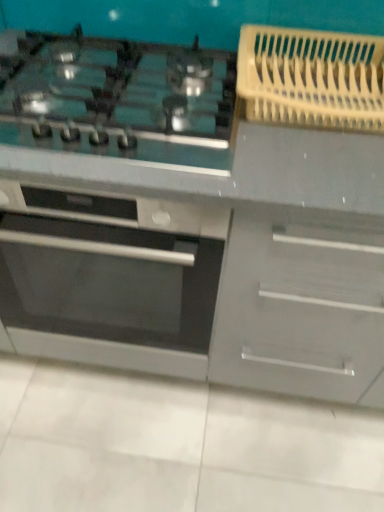
Image resolution: width=384 pixels, height=512 pixels. I want to click on satin black cooktop at upper left, so click(118, 100).

What is the approximate height of satin black cooktop at upper left?

3.43 inches.

What do you see at coordinates (118, 100) in the screenshot? I see `satin black cooktop at upper left` at bounding box center [118, 100].

Describe the element at coordinates (108, 280) in the screenshot. I see `satin silver oven at center` at that location.

Identify the location of satin silver oven at center. This screenshot has height=512, width=384. (108, 280).

Locate an element on the screen. The height and width of the screenshot is (512, 384). satin black cooktop at upper left is located at coordinates (118, 100).

Is satin silver oven at center at the right side of satin black cooktop at upper left?

No, satin silver oven at center is not to the right of satin black cooktop at upper left.

Considering their positions, is satin silver oven at center located in front of or behind satin black cooktop at upper left?

Clearly, satin silver oven at center is behind satin black cooktop at upper left.

Which point is more forward, [72,268] or [135,59]?

The point [135,59] is closer.

Based on the photo, from the image's perspective, between satin silver oven at center and satin black cooktop at upper left, who is located below?

satin silver oven at center, from the image's perspective.

From a real-world perspective, is satin silver oven at center below satin black cooktop at upper left?

Indeed, from a real-world perspective, satin silver oven at center is positioned beneath satin black cooktop at upper left.

Between satin silver oven at center and satin black cooktop at upper left, which one has smaller width?

With smaller width is satin black cooktop at upper left.

Who is shorter, satin silver oven at center or satin black cooktop at upper left?

Standing shorter between the two is satin black cooktop at upper left.

Which of these two, satin silver oven at center or satin black cooktop at upper left, is smaller?

Smaller between the two is satin black cooktop at upper left.

Can we say satin silver oven at center lies outside satin black cooktop at upper left?

Absolutely, satin silver oven at center is external to satin black cooktop at upper left.

From the picture: Is satin silver oven at center not near satin black cooktop at upper left?

Actually, satin silver oven at center and satin black cooktop at upper left are a little close together.

Is satin silver oven at center looking in the opposite direction of satin black cooktop at upper left?

No, satin silver oven at center is not facing away from satin black cooktop at upper left.

The width and height of the screenshot is (384, 512). In order to click on gas stove in front of the satin silver oven at center in this screenshot , I will do `click(118, 100)`.

Considering the relative positions of satin black cooktop at upper left and satin silver oven at center in the image provided, is satin black cooktop at upper left to the left or to the right of satin silver oven at center?

In the image, satin black cooktop at upper left appears on the right side of satin silver oven at center.

Between satin black cooktop at upper left and satin silver oven at center, which one is positioned in front?

satin black cooktop at upper left.

Between point (167, 64) and point (165, 228), which one is positioned in front?

The point (165, 228) is in front.

From the image's perspective, is satin black cooktop at upper left located above or below satin silver oven at center?

Clearly, from the image's perspective, satin black cooktop at upper left is above satin silver oven at center.

Looking at this image, from a real-world perspective, which is physically below, satin black cooktop at upper left or satin silver oven at center?

From a 3D spatial view, satin silver oven at center is below.

Which object is wider, satin black cooktop at upper left or satin silver oven at center?

With larger width is satin silver oven at center.

Can you confirm if satin black cooktop at upper left is taller than satin silver oven at center?

No.

Is satin black cooktop at upper left smaller than satin silver oven at center?

Indeed, satin black cooktop at upper left has a smaller size compared to satin silver oven at center.

Would you say satin black cooktop at upper left contains satin silver oven at center?

Actually, satin silver oven at center is outside satin black cooktop at upper left.

Is satin black cooktop at upper left placed right next to satin silver oven at center?

There is a gap between satin black cooktop at upper left and satin silver oven at center.

Is satin black cooktop at upper left turned away from satin silver oven at center?

No, satin silver oven at center is not at the back of satin black cooktop at upper left.

What are the coordinates of `gas stove located on the right of satin silver oven at center` in the screenshot? It's located at (118, 100).

What are the coordinates of `oven located below the satin black cooktop at upper left (from the image's perspective)` in the screenshot? It's located at (108, 280).

In order to click on oven to the left of satin black cooktop at upper left in this screenshot , I will do `click(108, 280)`.